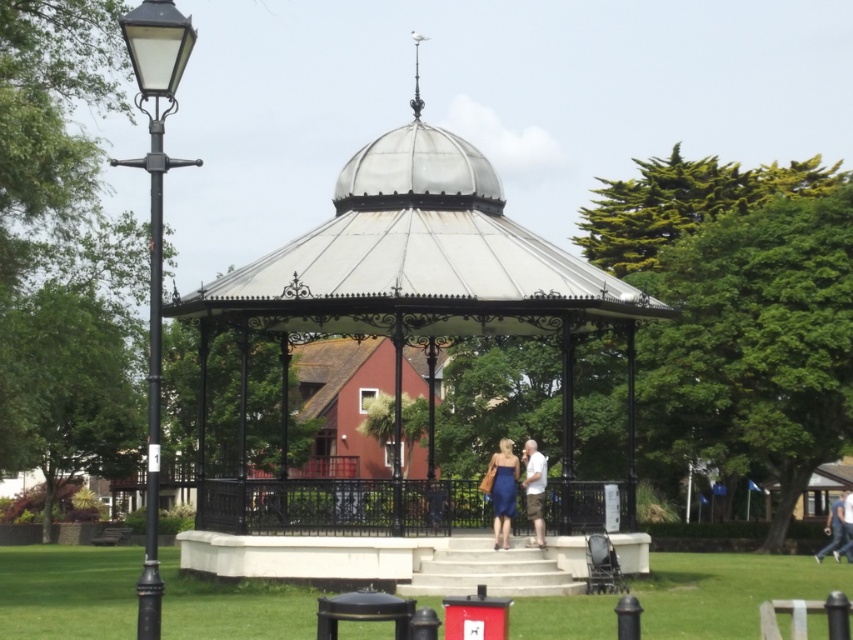
Between polished metal gazebo at center and light brown leather jacket at lower center, which one is positioned higher?

Positioned higher is polished metal gazebo at center.

Who is more forward, (289, 321) or (526, 468)?

Point (526, 468)

What are the coordinates of `polished metal gazebo at center` in the screenshot? It's located at (422, 264).

Can you confirm if light brown leather jacket at lower center is positioned above light blue jeans at lower right?

Correct, light brown leather jacket at lower center is located above light blue jeans at lower right.

Is light brown leather jacket at lower center bigger than light blue jeans at lower right?

Actually, light brown leather jacket at lower center might be smaller than light blue jeans at lower right.

You are a GUI agent. You are given a task and a screenshot of the screen. Output one action in this format:
    pyautogui.click(x=<x>, y=<y>)
    Task: Click on the light brown leather jacket at lower center
    The width and height of the screenshot is (853, 640).
    Given the screenshot: What is the action you would take?
    pos(534,486)

Find the location of a particular element. Image resolution: width=853 pixels, height=640 pixels. light brown leather jacket at lower center is located at coordinates (534, 486).

Is point (314, 243) behind point (143, 588)?

Yes.

Between point (521, 310) and point (154, 204), which one is positioned in front?

Point (154, 204)

Which is behind, point (438, 243) or point (143, 67)?

The point (438, 243) is behind.

At what (x,y) coordinates should I click in order to perform the action: click on polished metal gazebo at center. Please return your answer as a coordinate pair (x, y). Looking at the image, I should click on (422, 264).